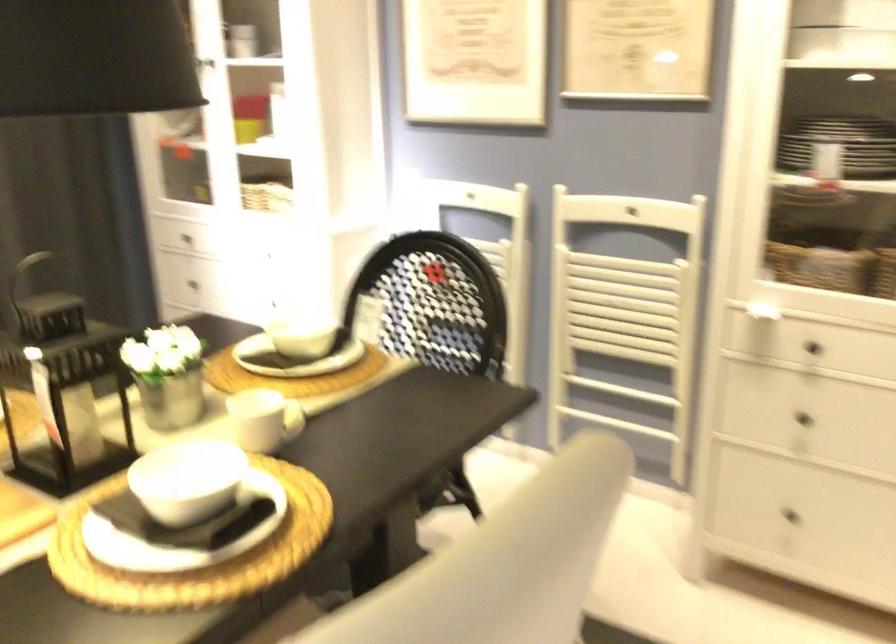
This screenshot has height=644, width=896. What are the coordinates of `white plate` in the screenshot? It's located at (298, 384).